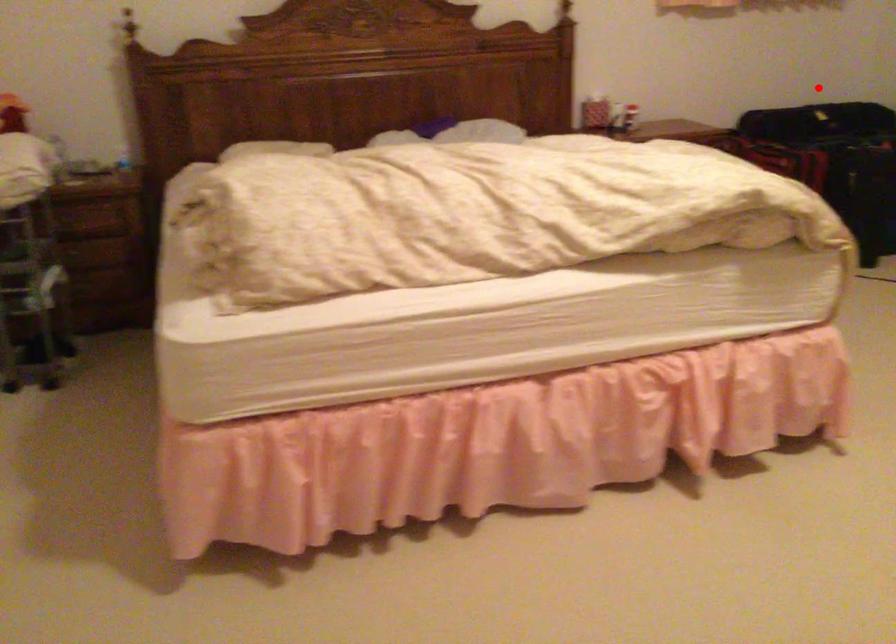
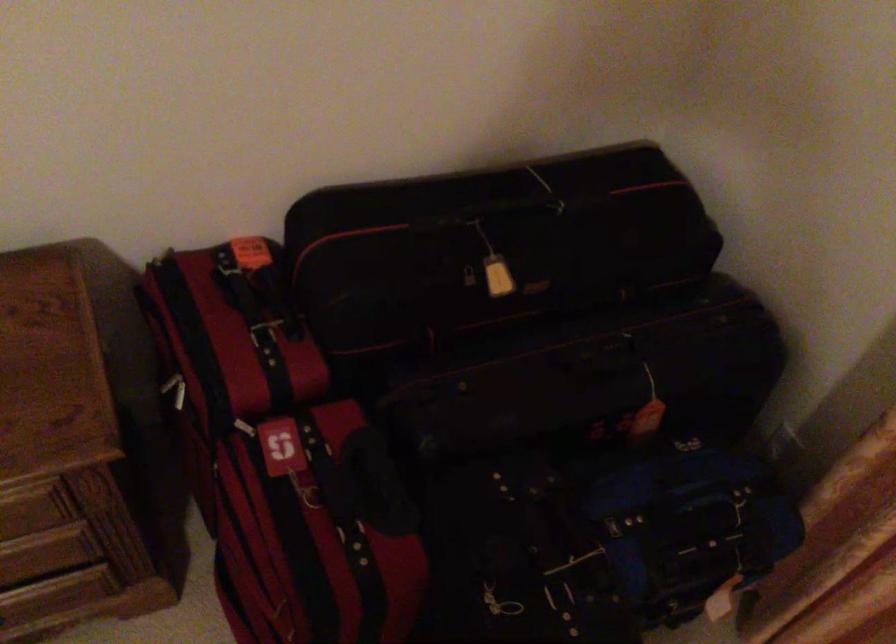
In the second image, find the point that corresponds to the highlighted location in the first image.

(470, 287)